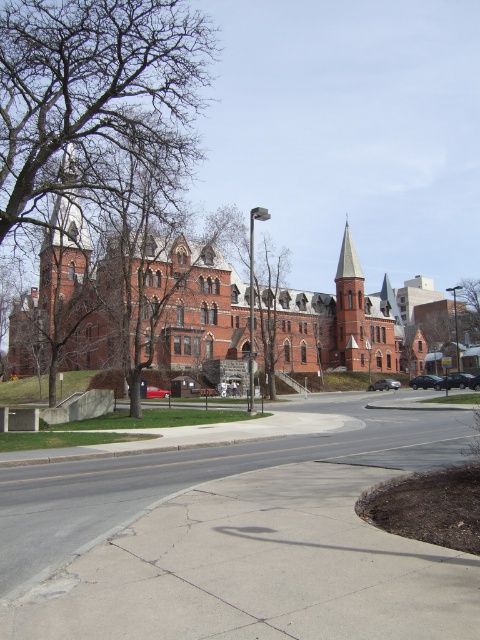
You are a landscape architect designing a new pathway near the brown leafless tree at upper left and the brown textured tree at center. Which tree has a wider spread, and should you consider this when planning the pathway?

The brown leafless tree at upper left has a wider spread than the brown textured tree at center, so yes, you should consider this when planning the pathway to ensure it doesn not encroach on the tree canopy.

You are a delivery person approaching the entrance of the historic building. You need to place a package on the concrete sidewalk at center. However, you notice a brown textured tree at center nearby. Which object is shorter in height between the two?

The concrete sidewalk at center has a lesser height compared to the brown textured tree at center, so the concrete sidewalk at center is shorter in height.

You are a gardener planning to plant a new row of flowers between the concrete sidewalk at center and the brown textured tree at center. Which object should you place the flowers closer to in order to ensure they have enough space to grow?

The brown textured tree at center occupies more space than the concrete sidewalk at center, so you should place the flowers closer to the concrete sidewalk at center to ensure they have enough space to grow.